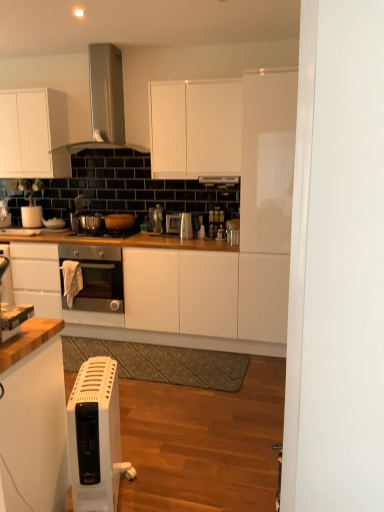
Question: From a real-world perspective, is satin silver toaster at center, the 3th appliance from the right, positioned under satin black oven at center based on gravity?

Choices:
 (A) yes
 (B) no

Answer: (B)

Question: Is satin silver toaster at center, the 3th appliance from the right, smaller than satin black oven at center?

Choices:
 (A) no
 (B) yes

Answer: (B)

Question: Is satin silver toaster at center, which ranks as the 5th appliance in front-to-back order, far from satin black oven at center?

Choices:
 (A) yes
 (B) no

Answer: (B)

Question: Is satin silver toaster at center, the 3th appliance from the right, positioned behind satin black oven at center?

Choices:
 (A) no
 (B) yes

Answer: (B)

Question: Can you confirm if satin silver toaster at center, which ranks as the 5th appliance in front-to-back order, is positioned to the left of satin black oven at center?

Choices:
 (A) no
 (B) yes

Answer: (A)

Question: From the image's perspective, relative to white plastic toaster at lower left, the 7th appliance in the back-to-front sequence, is satin silver kettle at center, placed as the sixth appliance when sorted from left to right, above or below?

Choices:
 (A) above
 (B) below

Answer: (A)

Question: Considering the positions of satin silver kettle at center, placed as the sixth appliance when sorted from left to right, and white plastic toaster at lower left, acting as the 1th appliance starting from the front, in the image, is satin silver kettle at center, placed as the sixth appliance when sorted from left to right, taller or shorter than white plastic toaster at lower left, acting as the 1th appliance starting from the front,?

Choices:
 (A) tall
 (B) short

Answer: (A)

Question: Is satin silver kettle at center, the third appliance when ordered from front to back, to the left or to the right of white plastic toaster at lower left, the 7th appliance in the back-to-front sequence, in the image?

Choices:
 (A) right
 (B) left

Answer: (A)

Question: Considering their positions, is satin silver kettle at center, the fifth appliance when ordered from back to front, located in front of or behind white plastic toaster at lower left, which ranks as the 3th appliance in left-to-right order?

Choices:
 (A) front
 (B) behind

Answer: (B)

Question: Considering the positions of white matte paper towel holder at left, the first appliance in the left-to-right sequence, and satin silver range hood at upper center in the image, is white matte paper towel holder at left, the first appliance in the left-to-right sequence, bigger or smaller than satin silver range hood at upper center?

Choices:
 (A) big
 (B) small

Answer: (B)

Question: Is point (31, 217) closer or farther from the camera than point (109, 131)?

Choices:
 (A) closer
 (B) farther

Answer: (B)

Question: From the image's perspective, is white matte paper towel holder at left, the first appliance in the left-to-right sequence, positioned above or below satin silver range hood at upper center?

Choices:
 (A) above
 (B) below

Answer: (B)

Question: Is white matte paper towel holder at left, the first appliance in the left-to-right sequence, to the left or to the right of satin silver range hood at upper center in the image?

Choices:
 (A) right
 (B) left

Answer: (B)

Question: Is satin silver range hood at upper center wider or thinner than white plastic toaster at lower left, which is counted as the 5th appliance, starting from the right?

Choices:
 (A) thin
 (B) wide

Answer: (B)

Question: Would you say satin silver range hood at upper center is to the left or to the right of white plastic toaster at lower left, which is counted as the 5th appliance, starting from the right, in the picture?

Choices:
 (A) left
 (B) right

Answer: (A)